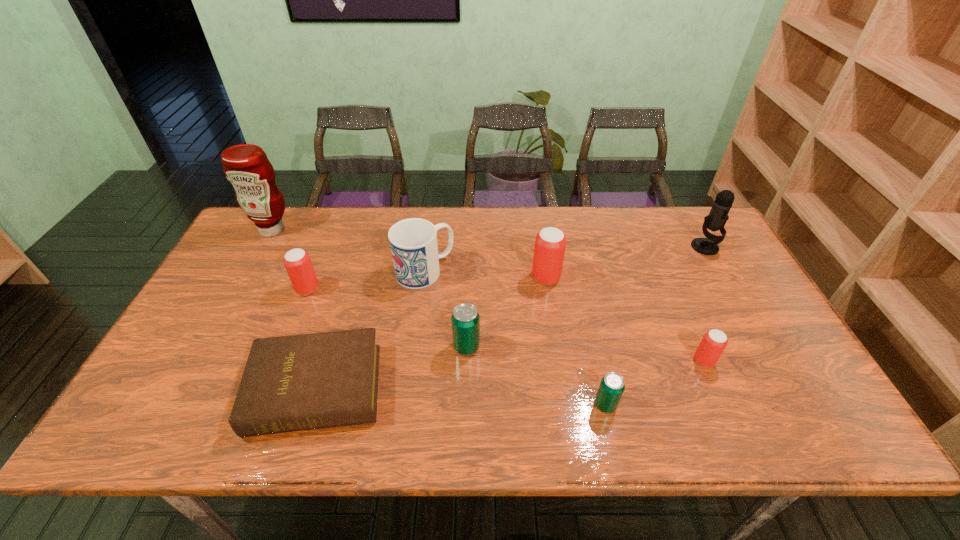
This screenshot has width=960, height=540. I want to click on object that is positioned at the left edge, so click(246, 166).

In order to click on object situated at the right edge in this screenshot , I will do `click(718, 216)`.

This screenshot has height=540, width=960. I want to click on object that is at the far left corner, so click(x=246, y=166).

Locate an element on the screen. This screenshot has height=540, width=960. object situated at the far right corner is located at coordinates (718, 216).

In the image, there is a desktop. Identify the location of vacant space at the far edge. The width and height of the screenshot is (960, 540). (586, 217).

Locate an element on the screen. The image size is (960, 540). vacant space at the left edge of the desktop is located at coordinates (240, 253).

You are a GUI agent. You are given a task and a screenshot of the screen. Output one action in this format:
    pyautogui.click(x=<x>, y=<y>)
    Task: Click on the free spot between the fourth object from right to left and the left teal beer can
    This screenshot has width=960, height=540.
    Given the screenshot: What is the action you would take?
    pyautogui.click(x=506, y=312)

You are a GUI agent. You are given a task and a screenshot of the screen. Output one action in this format:
    pyautogui.click(x=<x>, y=<y>)
    Task: Click on the unoccupied area between the blue mug and the leftmost red beer can
    
    Given the screenshot: What is the action you would take?
    (366, 280)

Find the location of a particular element. The height and width of the screenshot is (540, 960). free area in between the second tallest object and the fourth beer can from left to right is located at coordinates (656, 326).

Where is `vacant area that lies between the fourth beer can from left to right and the Bible`? vacant area that lies between the fourth beer can from left to right and the Bible is located at coordinates (461, 396).